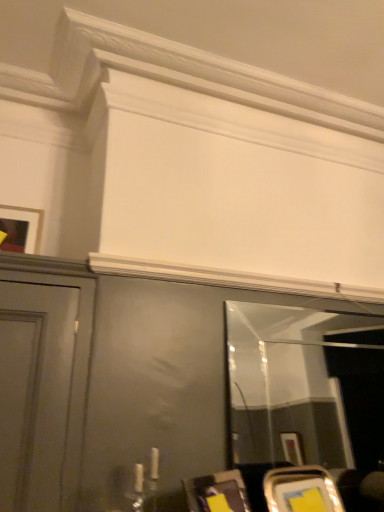
The height and width of the screenshot is (512, 384). What do you see at coordinates (21, 229) in the screenshot?
I see `matte black picture frame at upper left` at bounding box center [21, 229].

The image size is (384, 512). In order to click on matte black picture frame at upper left in this screenshot , I will do `click(21, 229)`.

In order to click on clear glass mirror at center in this screenshot , I will do `click(305, 387)`.

In order to face clear glass mirror at center, should I rotate leftwards or rightwards?

Turn right approximately 16.641 degrees to face it.

Based on the photo, what is the approximate width of clear glass mirror at center?

clear glass mirror at center is 1.45 inches wide.

Describe the element at coordinates (305, 387) in the screenshot. I see `clear glass mirror at center` at that location.

I want to click on matte black picture frame at upper left, so click(21, 229).

Considering the relative positions of matte black picture frame at upper left and clear glass mirror at center in the image provided, is matte black picture frame at upper left to the left of clear glass mirror at center from the viewer's perspective?

Yes.

Between matte black picture frame at upper left and clear glass mirror at center, which one is positioned behind?

matte black picture frame at upper left is behind.

Is point (29, 245) closer to camera compared to point (311, 323)?

That is True.

From the image's perspective, which is below, matte black picture frame at upper left or clear glass mirror at center?

clear glass mirror at center, from the image's perspective.

From a real-world perspective, is matte black picture frame at upper left located beneath clear glass mirror at center?

No, from a real-world perspective, matte black picture frame at upper left is not under clear glass mirror at center.

Is matte black picture frame at upper left thinner than clear glass mirror at center?

Incorrect, the width of matte black picture frame at upper left is not less than that of clear glass mirror at center.

Considering the sizes of matte black picture frame at upper left and clear glass mirror at center in the image, is matte black picture frame at upper left taller or shorter than clear glass mirror at center?

Clearly, matte black picture frame at upper left is shorter compared to clear glass mirror at center.

Is matte black picture frame at upper left bigger or smaller than clear glass mirror at center?

In the image, matte black picture frame at upper left appears to be smaller than clear glass mirror at center.

Is clear glass mirror at center surrounded by matte black picture frame at upper left?

No, clear glass mirror at center is not surrounded by matte black picture frame at upper left.

Is matte black picture frame at upper left not near clear glass mirror at center?

That's right, there is a large distance between matte black picture frame at upper left and clear glass mirror at center.

Is matte black picture frame at upper left oriented towards clear glass mirror at center?

No, matte black picture frame at upper left is not oriented towards clear glass mirror at center.

Locate an element on the screen. mirror in front of the matte black picture frame at upper left is located at coordinates (305, 387).

Considering the relative positions of clear glass mirror at center and matte black picture frame at upper left in the image provided, is clear glass mirror at center to the left or to the right of matte black picture frame at upper left?

Based on their positions, clear glass mirror at center is located to the right of matte black picture frame at upper left.

Considering the positions of objects clear glass mirror at center and matte black picture frame at upper left in the image provided, who is in front, clear glass mirror at center or matte black picture frame at upper left?

clear glass mirror at center is closer to the camera.

Is point (262, 436) positioned after point (12, 236)?

That is True.

From the image's perspective, relative to matte black picture frame at upper left, is clear glass mirror at center above or below?

Based on their image positions, clear glass mirror at center is located beneath matte black picture frame at upper left.

From a real-world perspective, is clear glass mirror at center below matte black picture frame at upper left?

Yes, from a real-world perspective, clear glass mirror at center is beneath matte black picture frame at upper left.

Does clear glass mirror at center have a greater width compared to matte black picture frame at upper left?

No.

Considering the sizes of objects clear glass mirror at center and matte black picture frame at upper left in the image provided, who is taller, clear glass mirror at center or matte black picture frame at upper left?

Standing taller between the two is clear glass mirror at center.

Considering the sizes of clear glass mirror at center and matte black picture frame at upper left in the image, is clear glass mirror at center bigger or smaller than matte black picture frame at upper left?

clear glass mirror at center is bigger than matte black picture frame at upper left.

Can matte black picture frame at upper left be found inside clear glass mirror at center?

Definitely not — matte black picture frame at upper left is not inside clear glass mirror at center.

Is clear glass mirror at center placed right next to matte black picture frame at upper left?

No, clear glass mirror at center is not in contact with matte black picture frame at upper left.

Does clear glass mirror at center turn towards matte black picture frame at upper left?

No, clear glass mirror at center is not oriented towards matte black picture frame at upper left.

This screenshot has width=384, height=512. In order to click on picture frame to the left of clear glass mirror at center in this screenshot , I will do `click(21, 229)`.

Locate an element on the screen. The height and width of the screenshot is (512, 384). mirror that is on the right side of matte black picture frame at upper left is located at coordinates (305, 387).

Locate an element on the screen. This screenshot has width=384, height=512. picture frame behind the clear glass mirror at center is located at coordinates (21, 229).